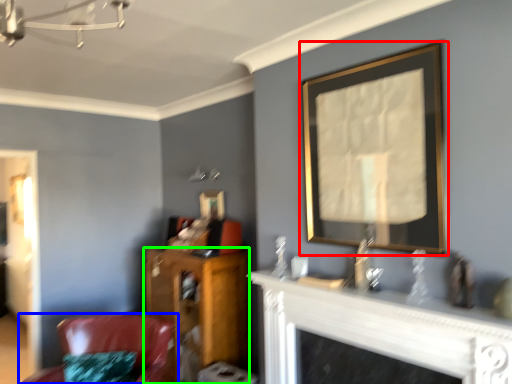
Question: Which object is the farthest from picture frame (highlighted by a red box)? Choose among these: chair (highlighted by a blue box) or furniture (highlighted by a green box).

Choices:
 (A) chair
 (B) furniture

Answer: (A)